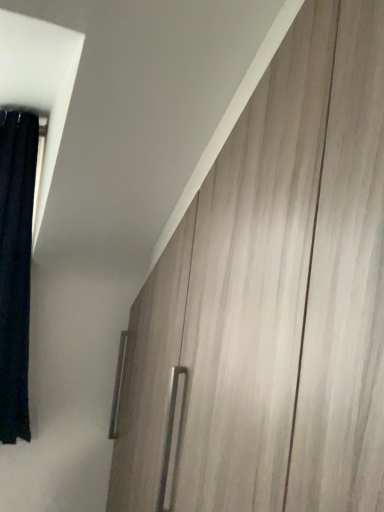
Question: Is wooden cabinet at right located within black fabric curtain at left?

Choices:
 (A) no
 (B) yes

Answer: (A)

Question: Does black fabric curtain at left appear on the right side of wooden cabinet at right?

Choices:
 (A) no
 (B) yes

Answer: (A)

Question: Considering the relative positions of black fabric curtain at left and wooden cabinet at right in the image provided, is black fabric curtain at left to the left of wooden cabinet at right from the viewer's perspective?

Choices:
 (A) yes
 (B) no

Answer: (A)

Question: Considering the relative sizes of black fabric curtain at left and wooden cabinet at right in the image provided, is black fabric curtain at left bigger than wooden cabinet at right?

Choices:
 (A) no
 (B) yes

Answer: (A)

Question: Does black fabric curtain at left lie behind wooden cabinet at right?

Choices:
 (A) yes
 (B) no

Answer: (A)

Question: Does black fabric curtain at left have a greater width compared to wooden cabinet at right?

Choices:
 (A) yes
 (B) no

Answer: (A)

Question: Can you confirm if wooden cabinet at right is positioned to the right of black fabric curtain at left?

Choices:
 (A) yes
 (B) no

Answer: (A)

Question: Would you say black fabric curtain at left is part of wooden cabinet at right's contents?

Choices:
 (A) no
 (B) yes

Answer: (A)

Question: Can you confirm if wooden cabinet at right is bigger than black fabric curtain at left?

Choices:
 (A) yes
 (B) no

Answer: (A)

Question: Does wooden cabinet at right have a greater height compared to black fabric curtain at left?

Choices:
 (A) no
 (B) yes

Answer: (B)

Question: Are wooden cabinet at right and black fabric curtain at left located far from each other?

Choices:
 (A) no
 (B) yes

Answer: (A)

Question: From the image's perspective, is wooden cabinet at right below black fabric curtain at left?

Choices:
 (A) yes
 (B) no

Answer: (A)

Question: Is black fabric curtain at left bigger or smaller than wooden cabinet at right?

Choices:
 (A) small
 (B) big

Answer: (A)